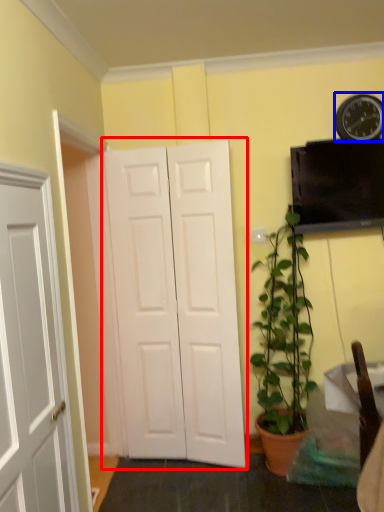
Question: Which point is further to the camera, door (highlighted by a red box) or clock (highlighted by a blue box)?

Choices:
 (A) door
 (B) clock

Answer: (B)